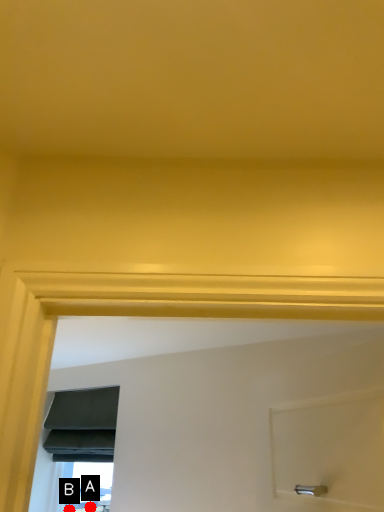
Question: Two points are circled on the image, labeled by A and B beside each circle. Which point is farther to the camera?

Choices:
 (A) A is further
 (B) B is further

Answer: (B)